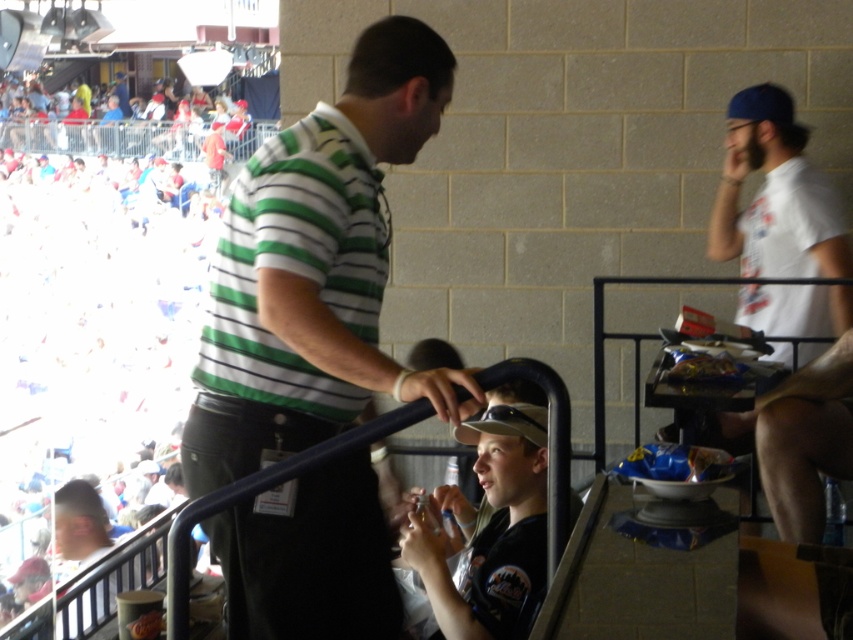
Question: Is white plastic cups at upper left bigger than khaki fabric cap at center?

Choices:
 (A) no
 (B) yes

Answer: (B)

Question: Among these objects, which one is nearest to the camera?

Choices:
 (A) khaki fabric cap at center
 (B) green striped shirt at center
 (C) white plastic cups at upper left

Answer: (B)

Question: Does white plastic cups at upper left come behind khaki fabric cap at center?

Choices:
 (A) no
 (B) yes

Answer: (A)

Question: Which object appears closest to the camera in this image?

Choices:
 (A) white plastic cups at upper left
 (B) khaki fabric cap at center
 (C) green striped shirt at center

Answer: (C)

Question: Does white plastic cups at upper left have a larger size compared to khaki fabric cap at center?

Choices:
 (A) yes
 (B) no

Answer: (A)

Question: Which object is positioned closest to the white plastic cups at upper left?

Choices:
 (A) khaki fabric cap at center
 (B) green striped shirt at center

Answer: (A)